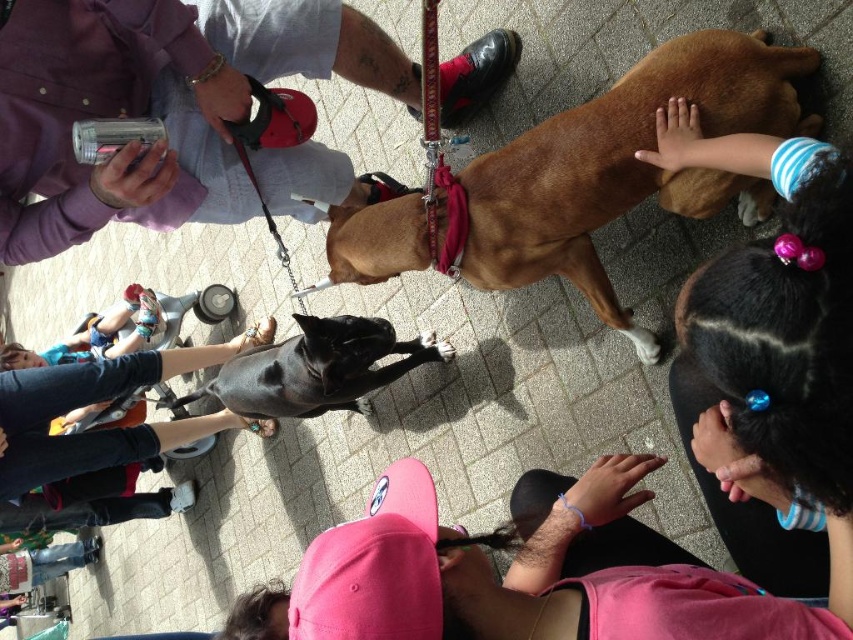
You are a photographer standing at the edge of the scene. You want to take a photo that includes both the pink fabric cap at lower center and the black leather pants at lower left. What is the minimum distance you need to move backward to ensure both objects are in frame?

The pink fabric cap at lower center and the black leather pants at lower left are 7.82 feet apart. To include both in the photo, you need to move backward until the camera can capture a field of view that accommodates this distance. The exact distance depends on the camera lens and sensor size, but generally, moving back several feet should suffice to frame both objects.

You are a dog trainer who needs to attach a leash to a dog. You see the matte black leash at upper center and the black smooth dog at center. Can you reach the dog with the leash without moving either?

The matte black leash at upper center and the black smooth dog at center are 26.33 inches apart. Since the leash length is not specified, but typically leashes are around 4 to 6 feet long, which is longer than 26.33 inches, so yes, the leash can reach the dog.

You are standing at the point labeled as point (173, 442) and want to walk to the point labeled as point (630, 468). Which direction should you move relative to your current position?

You should move forward because point (630, 468) is in front of point (173, 442).